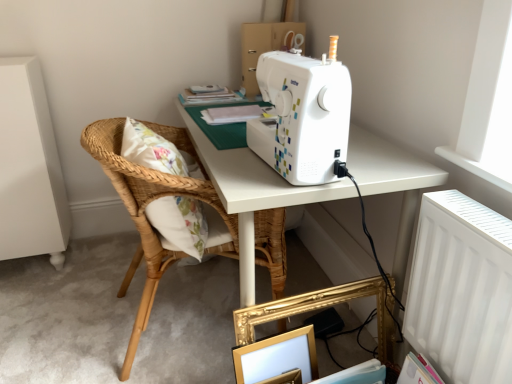
You are a GUI agent. You are given a task and a screenshot of the screen. Output one action in this format:
    pyautogui.click(x=<x>, y=<y>)
    Task: Click on the empty space that is to the right of white plastic sewing machine at upper center
    This screenshot has height=384, width=512.
    Given the screenshot: What is the action you would take?
    pyautogui.click(x=380, y=159)